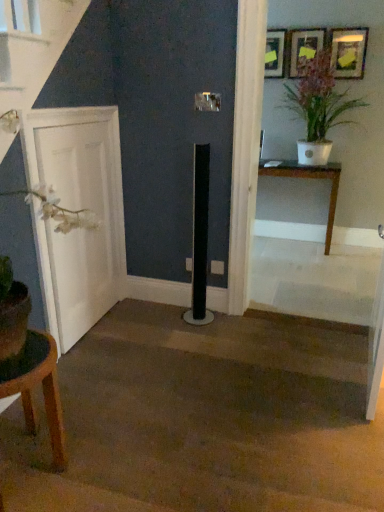
Locate an element on the screen. The image size is (384, 512). vacant area that lies to the right of brown wooden table at lower left, acting as the 1th table starting from the left is located at coordinates (107, 459).